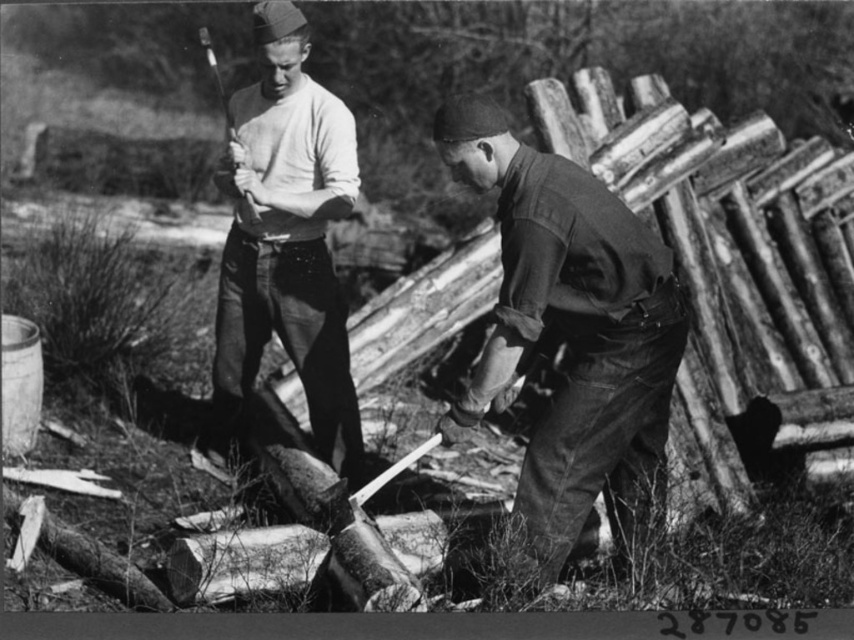
Question: Estimate the real-world distances between objects in this image. Which object is closer to the white matte shirt at center?

Choices:
 (A) dark green uniform at center
 (B) smooth wood ax at upper center

Answer: (B)

Question: Is dark green uniform at center below smooth wood ax at upper center?

Choices:
 (A) yes
 (B) no

Answer: (A)

Question: Does dark green uniform at center appear on the right side of white matte shirt at center?

Choices:
 (A) no
 (B) yes

Answer: (B)

Question: Which is nearer to the dark green uniform at center?

Choices:
 (A) smooth wood ax at upper center
 (B) white matte shirt at center

Answer: (B)

Question: Is dark green uniform at center above white matte shirt at center?

Choices:
 (A) no
 (B) yes

Answer: (A)

Question: Based on their relative distances, which object is farther from the white matte shirt at center?

Choices:
 (A) dark green uniform at center
 (B) smooth wood ax at upper center

Answer: (A)